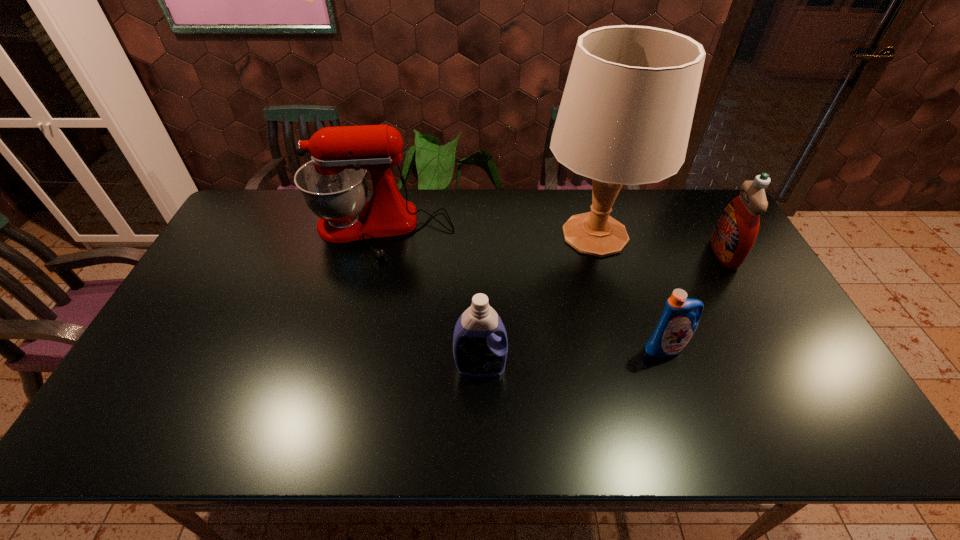
You are a GUI agent. You are given a task and a screenshot of the screen. Output one action in this format:
    pyautogui.click(x=<x>, y=<y>)
    Task: Click on the object that is the second closest to the shortest detergent
    The image size is (960, 540).
    Given the screenshot: What is the action you would take?
    pyautogui.click(x=734, y=235)

You are a GUI agent. You are given a task and a screenshot of the screen. Output one action in this format:
    pyautogui.click(x=<x>, y=<y>)
    Task: Click on the detergent that stands as the closest to the mixer
    
    Given the screenshot: What is the action you would take?
    pyautogui.click(x=478, y=352)

This screenshot has height=540, width=960. I want to click on the second closest detergent to the second object from left to right, so click(734, 235).

The width and height of the screenshot is (960, 540). Find the location of `vacant area in the image that satisfies the following two spatial constraints: 1. on the bowl side of the mixer; 2. on the right side of the table lamp`. vacant area in the image that satisfies the following two spatial constraints: 1. on the bowl side of the mixer; 2. on the right side of the table lamp is located at coordinates (378, 235).